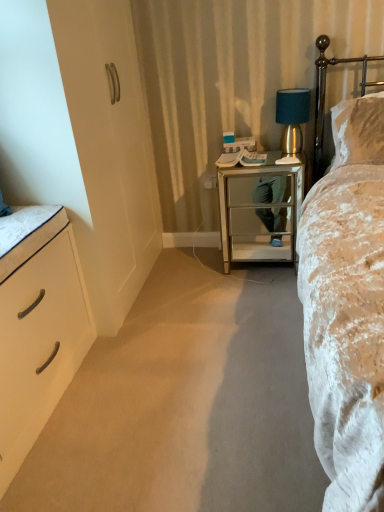
Question: Is teal fabric lampshade at right to the left or to the right of white matte chest of drawers at left in the image?

Choices:
 (A) left
 (B) right

Answer: (B)

Question: Considering their positions, is teal fabric lampshade at right located in front of or behind white matte chest of drawers at left?

Choices:
 (A) behind
 (B) front

Answer: (A)

Question: Estimate the real-world distances between objects in this image. Which object is farther from the gold metallic headboard at upper right?

Choices:
 (A) silver mirrored nightstand at center
 (B) teal fabric lampshade at right
 (C) white matte chest of drawers at left
 (D) velvet beige bed at right

Answer: (C)

Question: Which is nearer to the gold metallic headboard at upper right?

Choices:
 (A) silver mirrored nightstand at center
 (B) white matte chest of drawers at left
 (C) velvet beige bed at right
 (D) teal fabric lampshade at right

Answer: (D)